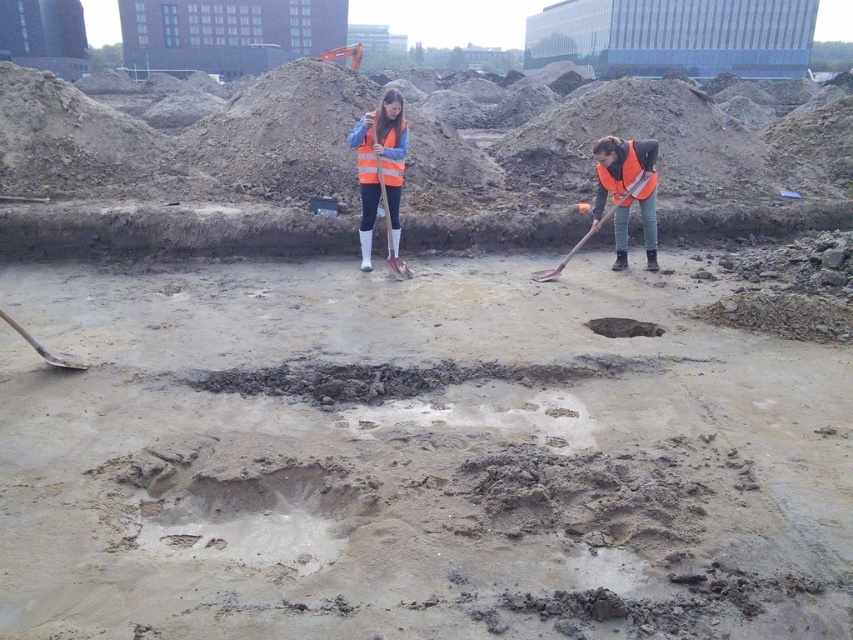
Question: Is shiny metallic puddle at center closer to camera compared to metallic shovel at right?

Choices:
 (A) yes
 (B) no

Answer: (A)

Question: Can you confirm if shiny metallic puddle at center is thinner than metallic silver shovel at lower left?

Choices:
 (A) yes
 (B) no

Answer: (B)

Question: Which object is farther from the camera taking this photo?

Choices:
 (A) shiny metallic puddle at center
 (B) orange plastic shovel at center
 (C) metallic shovel at right
 (D) orange reflective vest at center

Answer: (D)

Question: In this image, where is metallic shovel at right located relative to metallic silver shovel at lower left?

Choices:
 (A) left
 (B) right

Answer: (B)

Question: Which object appears farthest from the camera in this image?

Choices:
 (A) shiny metallic puddle at center
 (B) orange plastic shovel at center
 (C) metallic silver shovel at lower left
 (D) metallic shovel at right

Answer: (D)

Question: Among these objects, which one is nearest to the camera?

Choices:
 (A) shiny metallic puddle at center
 (B) orange plastic shovel at center

Answer: (A)